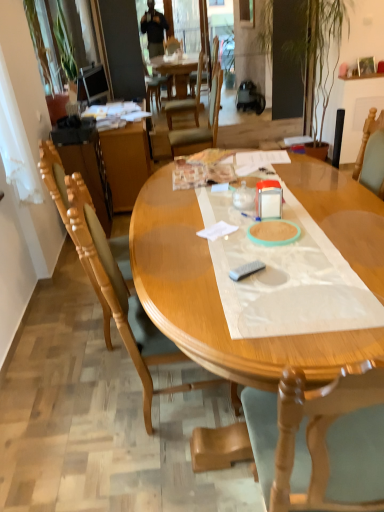
Question: From a real-world perspective, is transparent plastic bottle at center physically located above or below wooden desk at center?

Choices:
 (A) below
 (B) above

Answer: (B)

Question: Choose the correct answer: Is transparent plastic bottle at center inside wooden desk at center or outside it?

Choices:
 (A) inside
 (B) outside

Answer: (B)

Question: Estimate the real-world distances between objects in this image. Which object is closer to the metallic silver container at center?

Choices:
 (A) green leafy plant at upper left
 (B) matte black television at upper left
 (C) wooden table at center
 (D) transparent plastic bottle at center
 (E) wooden chair at center, which is the 1th chair from back to front

Answer: (D)

Question: Based on their relative distances, which object is nearer to the transparent plastic sheet at center?

Choices:
 (A) transparent plastic bottle at center
 (B) matte black television at upper left
 (C) wooden chair at center, acting as the third chair starting from the front
 (D) green leafy plant at upper left
 (E) wooden desk at center

Answer: (A)